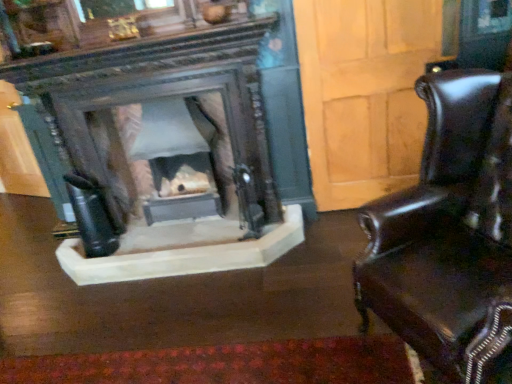
Question: In terms of size, does shiny brown leather chair at right appear bigger or smaller than smooth stone fireplace at center?

Choices:
 (A) big
 (B) small

Answer: (A)

Question: From the image's perspective, is shiny brown leather chair at right positioned above or below smooth stone fireplace at center?

Choices:
 (A) below
 (B) above

Answer: (A)

Question: From a real-world perspective, is shiny brown leather chair at right above or below smooth stone fireplace at center?

Choices:
 (A) above
 (B) below

Answer: (A)

Question: Would you say smooth stone fireplace at center is inside or outside shiny brown leather chair at right?

Choices:
 (A) inside
 (B) outside

Answer: (B)

Question: Considering the relative positions of smooth stone fireplace at center and shiny brown leather chair at right in the image provided, is smooth stone fireplace at center to the left or to the right of shiny brown leather chair at right?

Choices:
 (A) right
 (B) left

Answer: (B)

Question: Considering the positions of point (188, 193) and point (506, 210), is point (188, 193) closer or farther from the camera than point (506, 210)?

Choices:
 (A) closer
 (B) farther

Answer: (B)

Question: Considering their positions, is smooth stone fireplace at center located in front of or behind shiny brown leather chair at right?

Choices:
 (A) front
 (B) behind

Answer: (B)